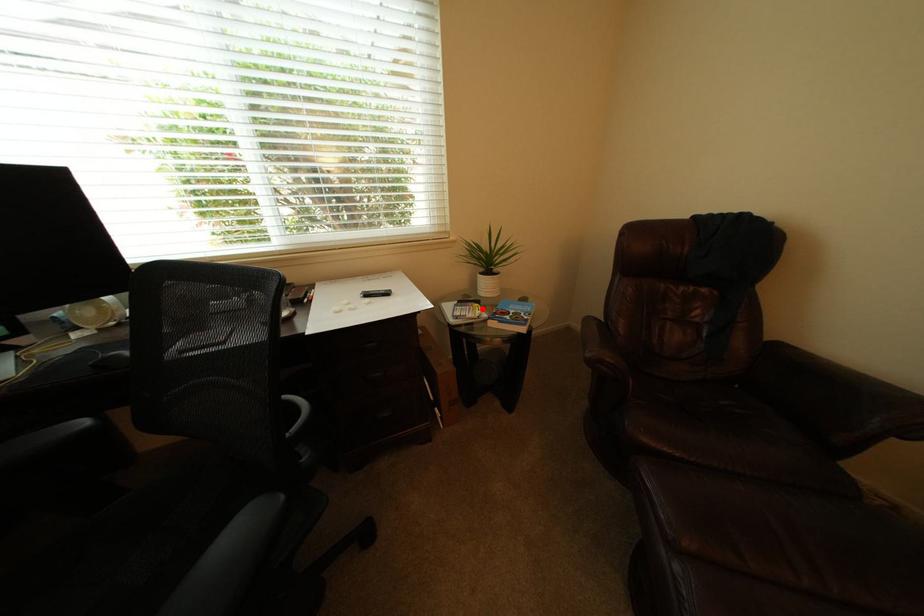
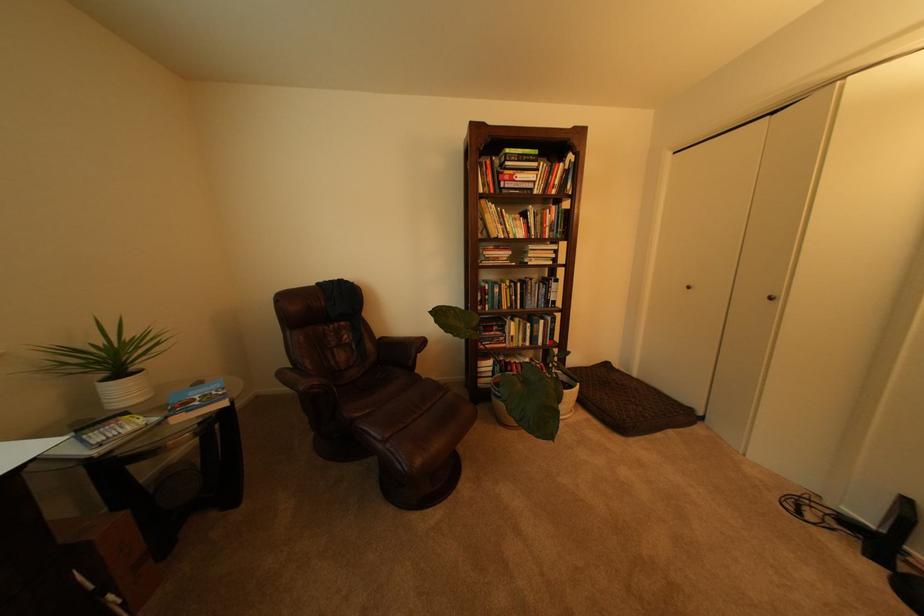
The point at the highlighted location is marked in the first image. Where is the corresponding point in the second image?

(130, 424)